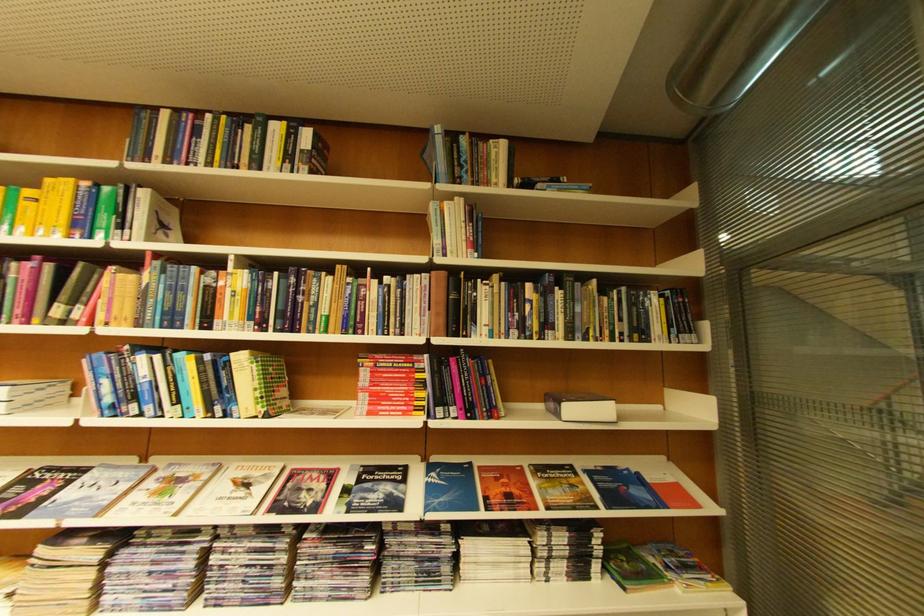
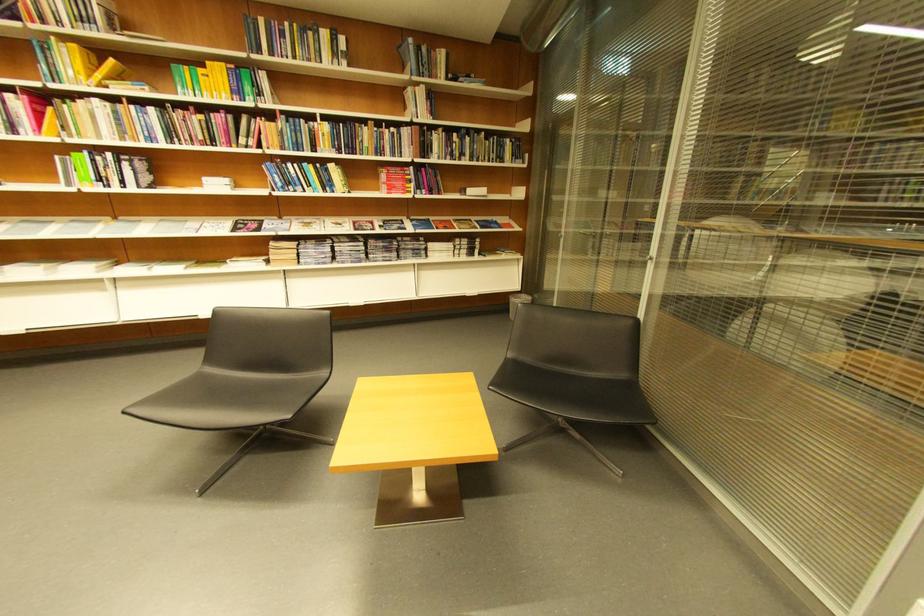
Where in the second image is the point corresponding to (x=397, y=281) from the first image?

(403, 131)